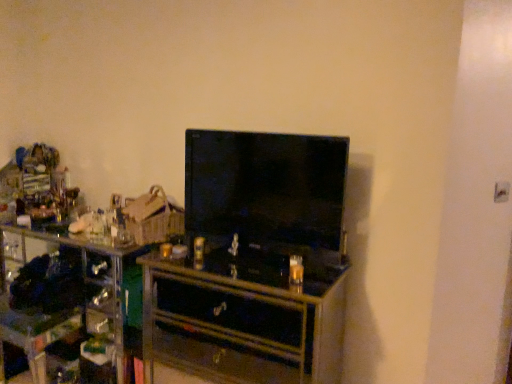
The width and height of the screenshot is (512, 384). What are the coordinates of `black glossy television at center` in the screenshot? It's located at (265, 187).

Describe the element at coordinates (265, 187) in the screenshot. I see `black glossy television at center` at that location.

What do you see at coordinates (243, 319) in the screenshot? I see `wooden chest of drawers at center` at bounding box center [243, 319].

You are a GUI agent. You are given a task and a screenshot of the screen. Output one action in this format:
    pyautogui.click(x=<x>, y=<y>)
    Task: Click on the wooden chest of drawers at center
    
    Given the screenshot: What is the action you would take?
    pyautogui.click(x=243, y=319)

Locate an element on the screen. black glossy television at center is located at coordinates (265, 187).

Can you confirm if wooden chest of drawers at center is positioned to the right of black glossy television at center?

Incorrect, wooden chest of drawers at center is not on the right side of black glossy television at center.

Does wooden chest of drawers at center lie behind black glossy television at center?

No.

Which is less distant, (191, 321) or (269, 214)?

The point (191, 321) is closer to the camera.

From the image's perspective, is wooden chest of drawers at center located above black glossy television at center?

Incorrect, from the image's perspective, wooden chest of drawers at center is lower than black glossy television at center.

From a real-world perspective, is wooden chest of drawers at center on black glossy television at center?

No, from a real-world perspective, wooden chest of drawers at center is not over black glossy television at center

Which object is thinner, wooden chest of drawers at center or black glossy television at center?

Thinner between the two is black glossy television at center.

Between wooden chest of drawers at center and black glossy television at center, which one has more height?

wooden chest of drawers at center.

Consider the image. In terms of size, does wooden chest of drawers at center appear bigger or smaller than black glossy television at center?

wooden chest of drawers at center is bigger than black glossy television at center.

Would you say wooden chest of drawers at center contains black glossy television at center?

Definitely not — black glossy television at center is not inside wooden chest of drawers at center.

Is wooden chest of drawers at center next to black glossy television at center?

wooden chest of drawers at center and black glossy television at center are not in contact.

Consider the image. Is wooden chest of drawers at center aimed at black glossy television at center?

No, wooden chest of drawers at center is not aimed at black glossy television at center.

What's the angular difference between wooden chest of drawers at center and black glossy television at center's facing directions?

They differ by 1.82 degrees in their facing directions.

How far apart are wooden chest of drawers at center and black glossy television at center?

wooden chest of drawers at center and black glossy television at center are 16.94 inches apart from each other.

The width and height of the screenshot is (512, 384). Identify the location of television above the wooden chest of drawers at center (from the image's perspective). (265, 187).

Is black glossy television at center to the left of wooden chest of drawers at center from the viewer's perspective?

In fact, black glossy television at center is to the right of wooden chest of drawers at center.

Is black glossy television at center positioned in front of wooden chest of drawers at center?

No, it is not.

Does point (210, 197) appear closer or farther from the camera than point (257, 349)?

Point (210, 197) appears to be closer to the viewer than point (257, 349).

From the image's perspective, is black glossy television at center above or below wooden chest of drawers at center?

black glossy television at center is situated higher than wooden chest of drawers at center in the image.

From a real-world perspective, relative to wooden chest of drawers at center, is black glossy television at center vertically above or below?

black glossy television at center is situated higher than wooden chest of drawers at center in the real world.

Which of these two, black glossy television at center or wooden chest of drawers at center, is thinner?

Thinner between the two is black glossy television at center.

Considering the sizes of objects black glossy television at center and wooden chest of drawers at center in the image provided, who is taller, black glossy television at center or wooden chest of drawers at center?

wooden chest of drawers at center.

In terms of size, does black glossy television at center appear bigger or smaller than wooden chest of drawers at center?

Clearly, black glossy television at center is smaller in size than wooden chest of drawers at center.

Does black glossy television at center contain wooden chest of drawers at center?

No.

Are black glossy television at center and wooden chest of drawers at center located far from each other?

No, black glossy television at center is in close proximity to wooden chest of drawers at center.

Is black glossy television at center aimed at wooden chest of drawers at center?

No, black glossy television at center is not aimed at wooden chest of drawers at center.

I want to click on television lying on the right of wooden chest of drawers at center, so click(265, 187).

The height and width of the screenshot is (384, 512). Identify the location of television that appears behind the wooden chest of drawers at center. (265, 187).

Find the location of `the chest of drawers in front of the black glossy television at center`. the chest of drawers in front of the black glossy television at center is located at coordinates (243, 319).